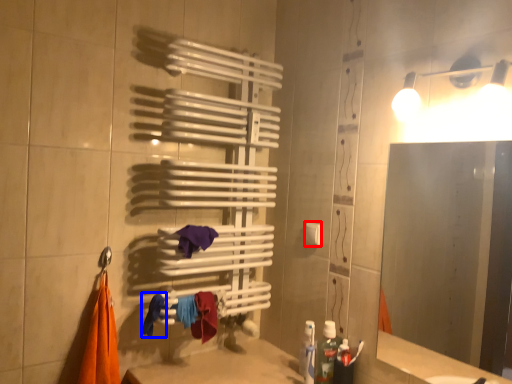
Question: Among these objects, which one is farthest to the camera, towel bar (highlighted by a red box) or clothe (highlighted by a blue box)?

Choices:
 (A) towel bar
 (B) clothe

Answer: (A)